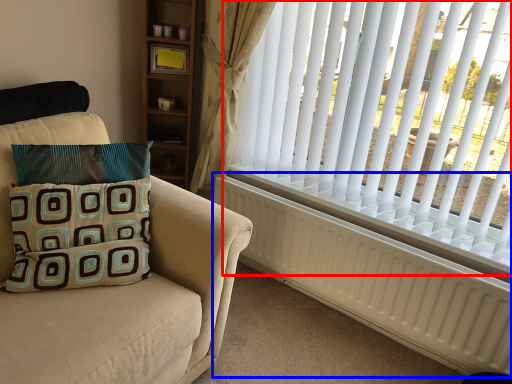
Question: Which object appears farthest to the camera in this image, window blind (highlighted by a red box) or radiator (highlighted by a blue box)?

Choices:
 (A) window blind
 (B) radiator

Answer: (B)